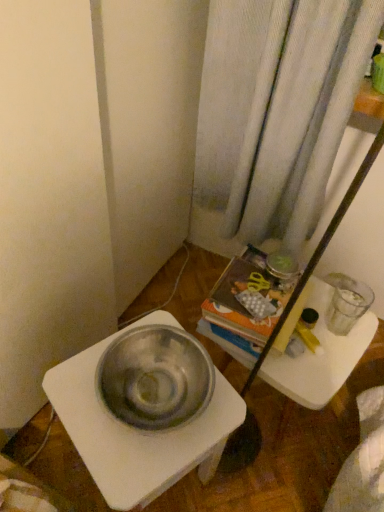
Locate an element on the screen. vacant area on top of metallic white table at lower left (from a real-world perspective) is located at coordinates (146, 406).